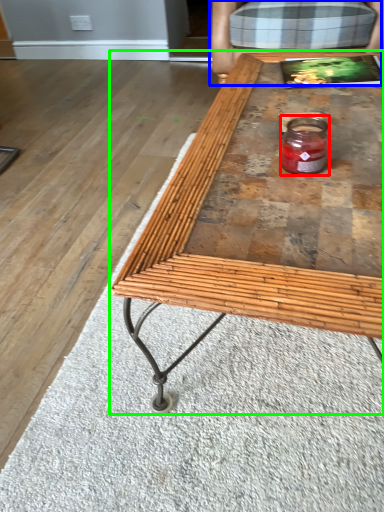
Question: Which object is the farthest from glass jar (highlighted by a red box)? Choose among these: armchair (highlighted by a blue box) or coffee table (highlighted by a green box).

Choices:
 (A) armchair
 (B) coffee table

Answer: (A)